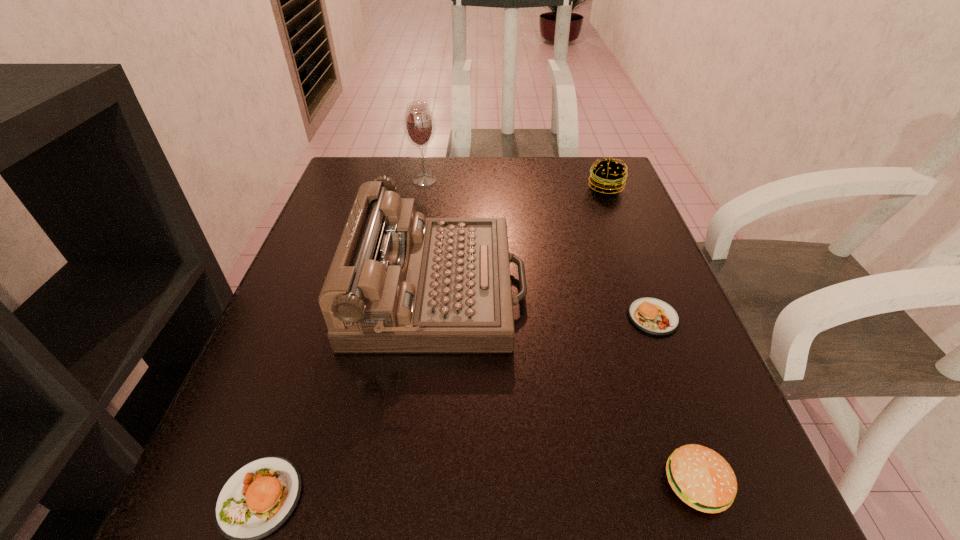
In order to click on patty that is at the far edge in this screenshot , I will do `click(607, 176)`.

Identify the location of object that is positioned at the near edge. The height and width of the screenshot is (540, 960). [700, 477].

Image resolution: width=960 pixels, height=540 pixels. I want to click on object that is at the left edge, so click(x=399, y=282).

This screenshot has height=540, width=960. What are the coordinates of `object present at the far right corner` in the screenshot? It's located at (607, 176).

Image resolution: width=960 pixels, height=540 pixels. In order to click on object that is at the near right corner in this screenshot , I will do `click(700, 477)`.

The image size is (960, 540). I want to click on vacant space at the far edge, so click(473, 160).

This screenshot has height=540, width=960. I want to click on vacant area at the near edge of the desktop, so click(x=346, y=475).

Where is `free spot at the left edge of the desktop`? free spot at the left edge of the desktop is located at coordinates (318, 300).

Where is `vacant space at the right edge of the desktop`? vacant space at the right edge of the desktop is located at coordinates (586, 209).

Find the location of a particular element. The height and width of the screenshot is (540, 960). blank space at the far left corner of the desktop is located at coordinates (340, 201).